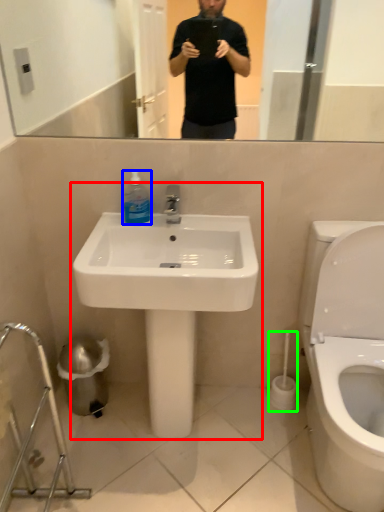
Question: Which object is positioned farthest from sink (highlighted by a red box)? Select from cleaning product (highlighted by a blue box) and brush (highlighted by a green box).

Choices:
 (A) cleaning product
 (B) brush

Answer: (B)